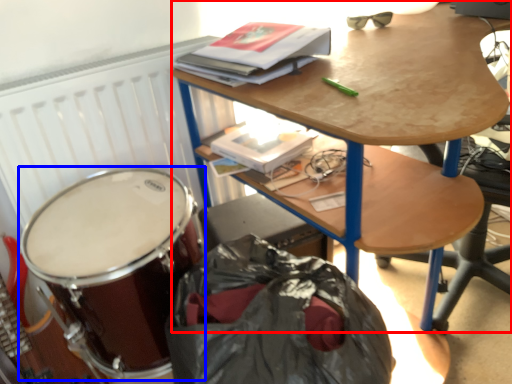
Question: Which object appears farthest to the camera in this image, desk (highlighted by a red box) or drum (highlighted by a blue box)?

Choices:
 (A) desk
 (B) drum

Answer: (B)